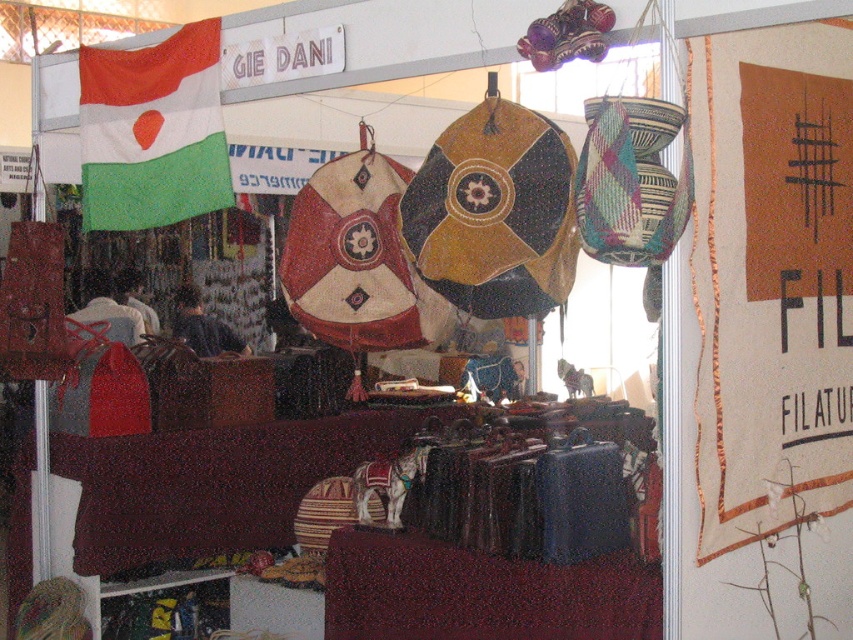
Which is above, brown fabric at upper right or green fabric flag at upper left?

green fabric flag at upper left is above.

Locate an element on the screen. brown fabric at upper right is located at coordinates (770, 276).

Find the location of `brown fabric at upper right`. brown fabric at upper right is located at coordinates (770, 276).